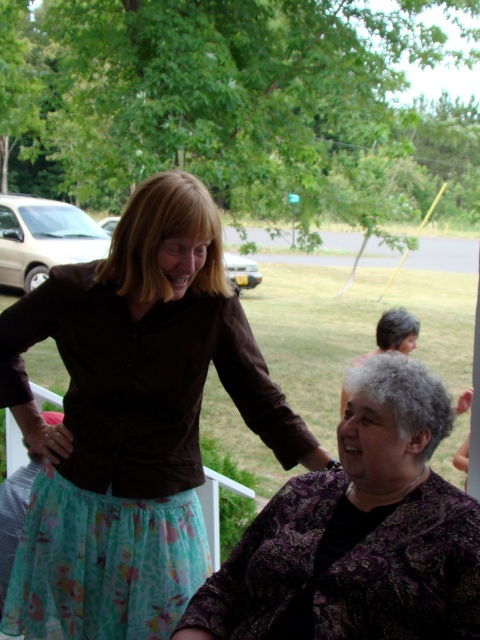
You are an interior designer planning to place a new plant stand between the floral chiffon skirt at upper left and the purple paisley blouse at lower right. Based on their positions, where should the plant stand be placed to ensure it is between both objects?

The plant stand should be placed between the floral chiffon skirt at upper left and the purple paisley blouse at lower right, positioned below the floral chiffon skirt at upper left and above the purple paisley blouse at lower right since the floral chiffon skirt at upper left is above the purple paisley blouse at lower right.

You are a fashion designer observing two outfits in the image. The floral chiffon skirt at upper left and the purple paisley blouse at lower right. Which of these two items has a larger size?

The floral chiffon skirt at upper left is bigger than the purple paisley blouse at lower right, so the floral chiffon skirt at upper left has a larger size.